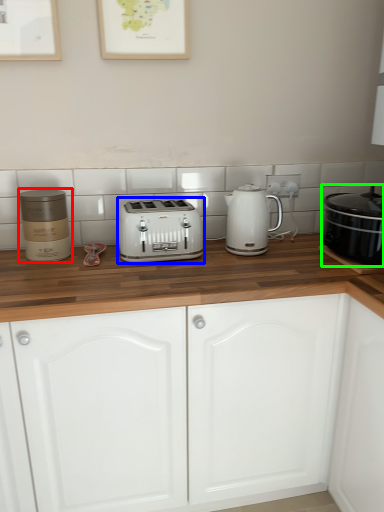
Question: Based on their relative distances, which object is nearer to appliance (highlighted by a red box)? Choose from toaster (highlighted by a blue box) and home appliance (highlighted by a green box).

Choices:
 (A) toaster
 (B) home appliance

Answer: (A)